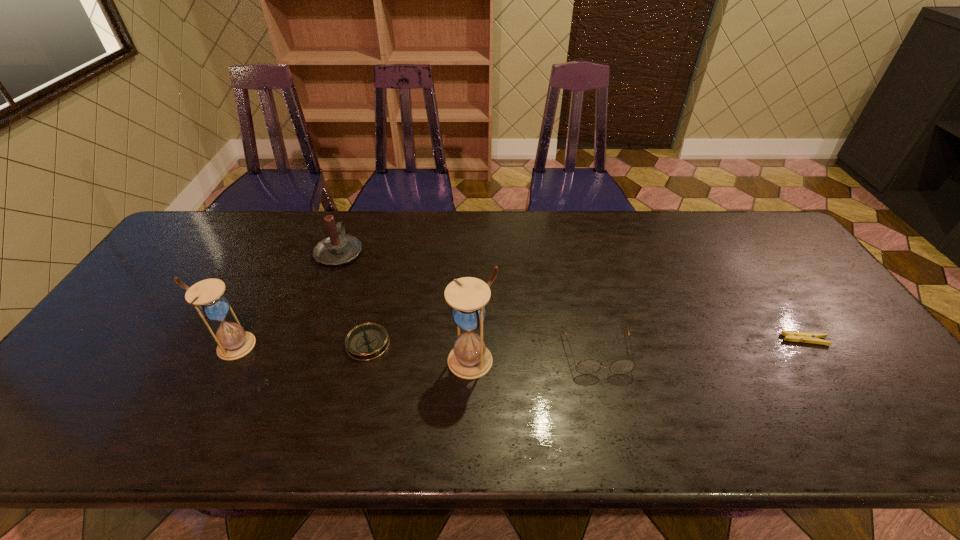
The hourglasss are evenly distributed in the image. To maintain this, where would you place another hourglass on the right? Please point to a free space. Please provide its 2D coordinates. Your answer should be formatted as a tuple, i.e. [(x, y)], where the tuple contains the x and y coordinates of a point satisfying the conditions above.

[(726, 376)]